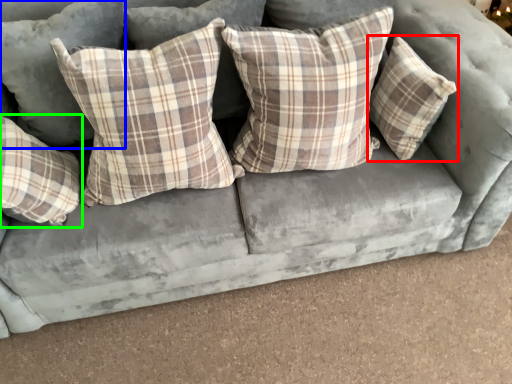
Question: Which object is positioned farthest from pillow (highlighted by a red box)? Select from pillow (highlighted by a blue box) and pillow (highlighted by a green box).

Choices:
 (A) pillow
 (B) pillow

Answer: (B)